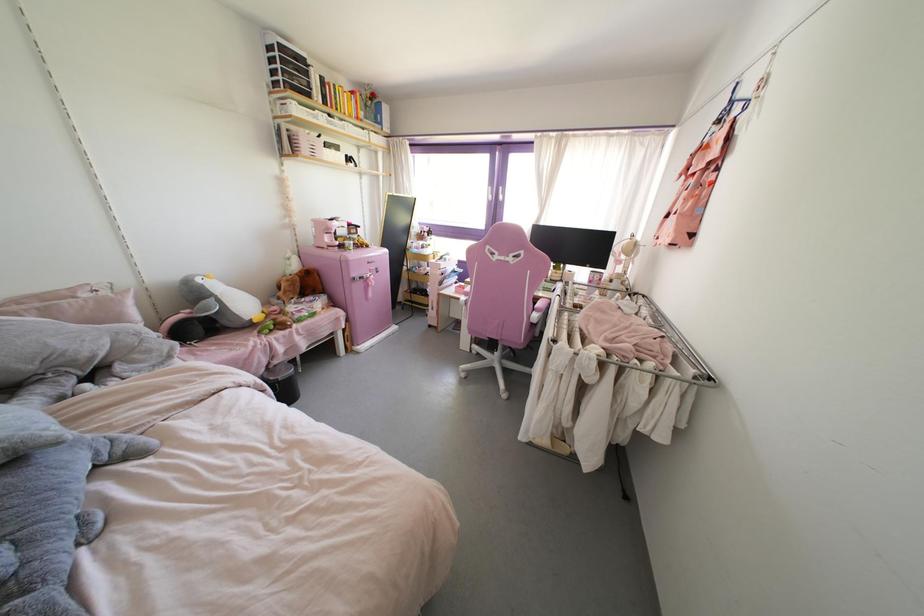
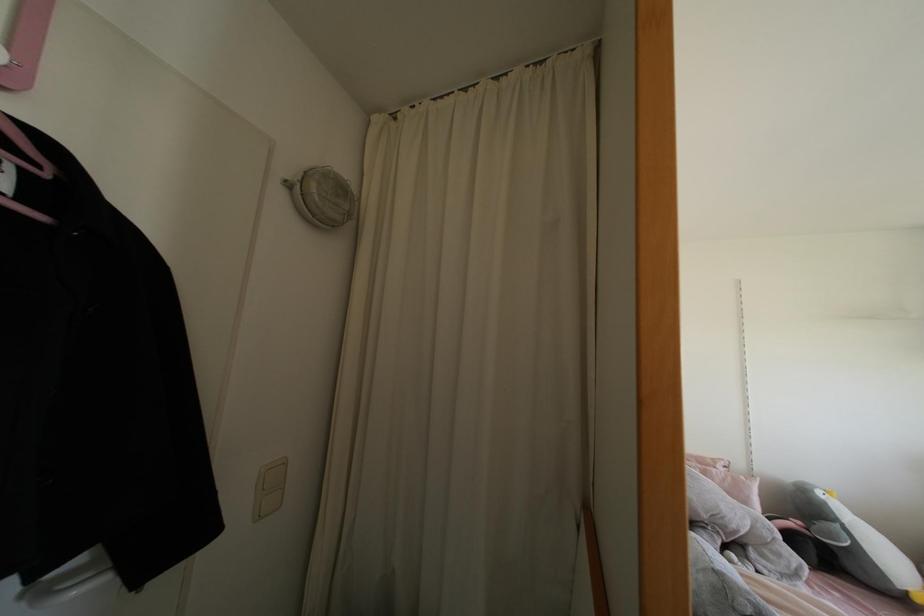
In the second image, find the point that corresponds to the point at 199,280 in the first image.

(819, 493)